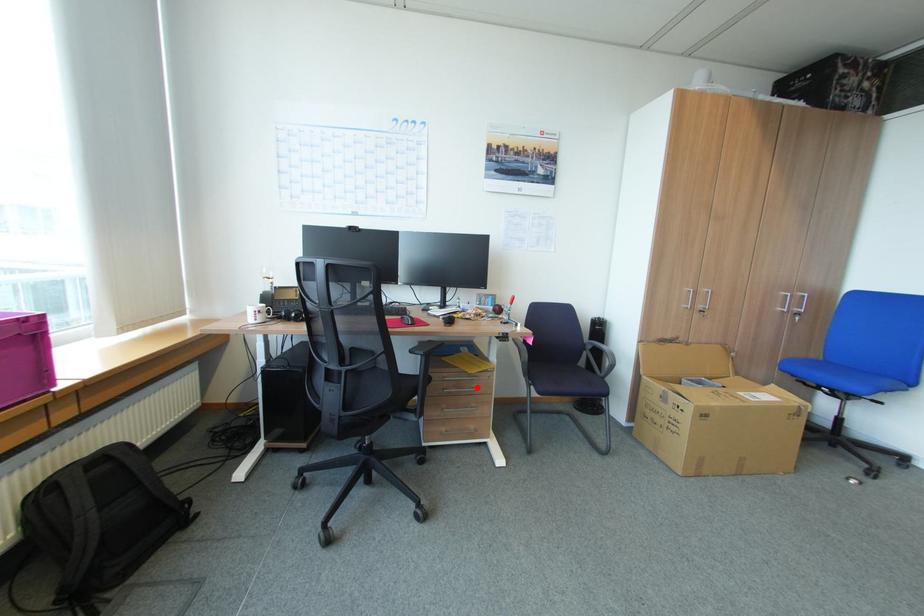
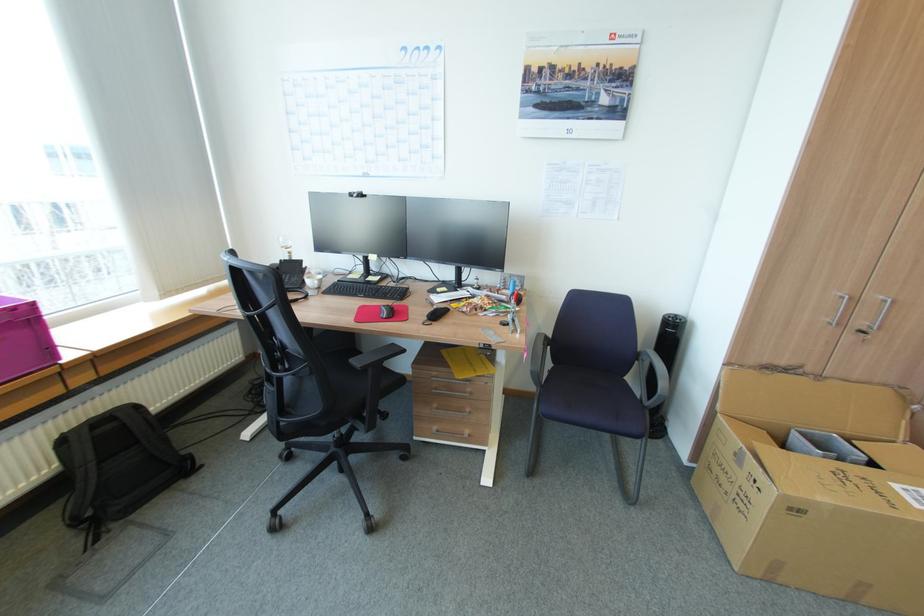
In the second image, find the point that corresponds to the highlighted location in the first image.

(469, 392)